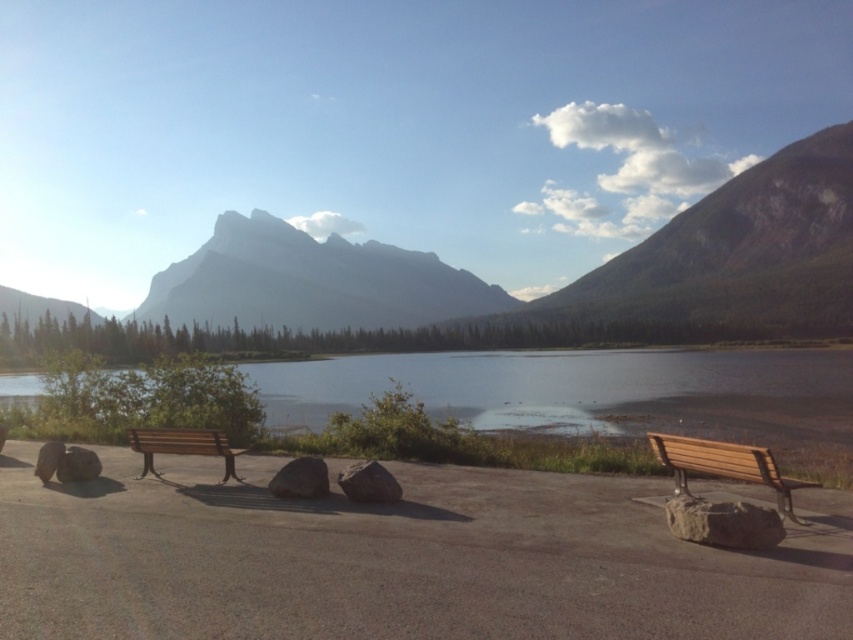
Question: Among these points, which one is nearest to the camera?

Choices:
 (A) (352, 486)
 (B) (788, 506)
 (C) (161, 428)

Answer: (B)

Question: Which point is farther to the camera?

Choices:
 (A) smokey gray rock at center
 (B) gray rough stone at lower right
 (C) gray rough rock at center

Answer: (A)

Question: Does matte gray mountain at center have a lesser width compared to smooth brown water at center?

Choices:
 (A) yes
 (B) no

Answer: (B)

Question: Is wooden bench at right positioned behind gray rough stone at lower left?

Choices:
 (A) no
 (B) yes

Answer: (A)

Question: Which point appears closest to the camera in this image?

Choices:
 (A) (45, 445)
 (B) (369, 296)

Answer: (A)

Question: Where is gray rough stone at lower right located in relation to gray rock at lower left in the image?

Choices:
 (A) left
 (B) right

Answer: (B)